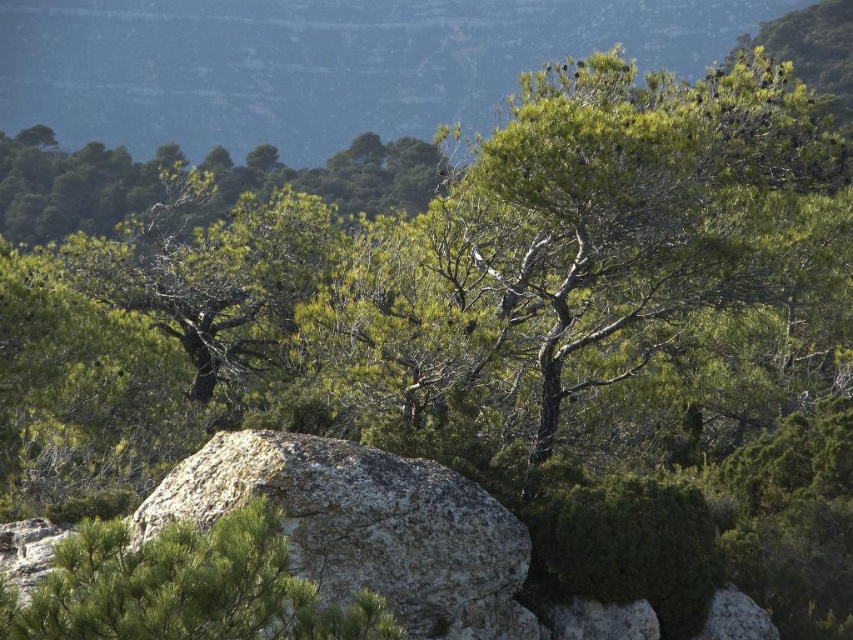
You are a hiker trying to cross a narrow path between the rough textured rock at center and the green leafy tree at center. The path is only 1.2 meters wide. Can your 0.8 meter wide backpack fit through without touching either object?

The rough textured rock at center is wider than the green leafy tree at center. However, the path between them is 1.2 meters wide, which is wider than your 0.8 meter wide backpack. Therefore, your backpack can fit through the path without touching either object.